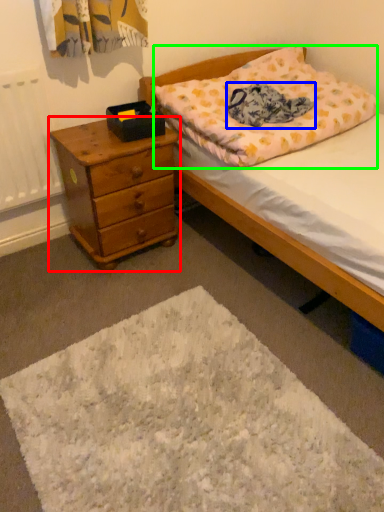
Question: Which object is the closest to the chest of drawers (highlighted by a red box)? Choose among these: blanket (highlighted by a blue box) or pillow (highlighted by a green box).

Choices:
 (A) blanket
 (B) pillow

Answer: (B)